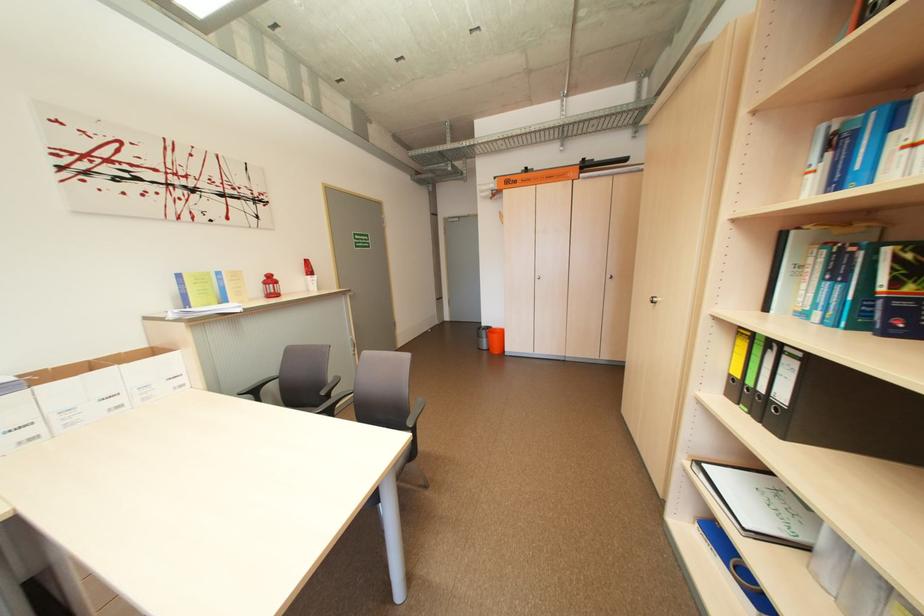
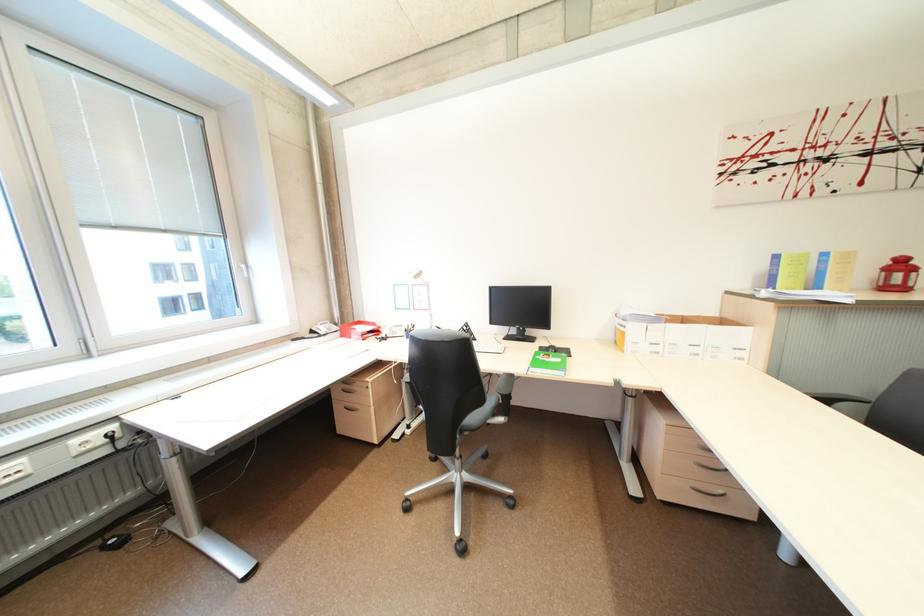
Where in the second image is the point corresponding to point 233,301 from the first image?

(825, 286)